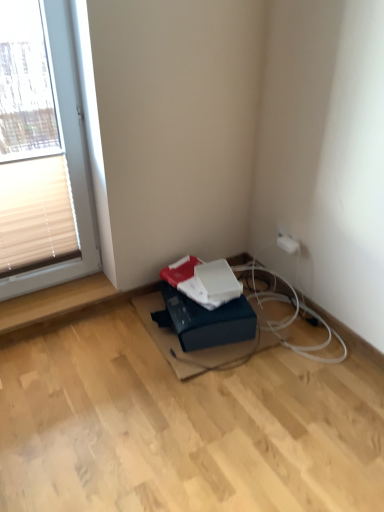
This screenshot has height=512, width=384. What do you see at coordinates (288, 243) in the screenshot?
I see `white plastic electric outlet at upper right` at bounding box center [288, 243].

Measure the distance between point [31,257] and camera.

The distance of point [31,257] from camera is 6.48 feet.

The width and height of the screenshot is (384, 512). Describe the element at coordinates (288, 318) in the screenshot. I see `black rubber cable at lower center` at that location.

You are a GUI agent. You are given a task and a screenshot of the screen. Output one action in this format:
    pyautogui.click(x=<x>, y=<y>)
    Task: Click on the white plastic electric outlet at upper right
    This screenshot has width=384, height=512.
    Given the screenshot: What is the action you would take?
    pyautogui.click(x=288, y=243)

Is beige fabric blind at left shorter than blue cardboard box at lower center?

Incorrect, the height of beige fabric blind at left does not fall short of that of blue cardboard box at lower center.

Consider the image. Is beige fabric blind at left bigger or smaller than blue cardboard box at lower center?

Clearly, beige fabric blind at left is smaller in size than blue cardboard box at lower center.

Can you see beige fabric blind at left touching blue cardboard box at lower center?

No, beige fabric blind at left is not beside blue cardboard box at lower center.

From a real-world perspective, which is physically above, beige fabric blind at left or blue cardboard box at lower center?

A: beige fabric blind at left is physically above.

Considering the relative sizes of black rubber cable at lower center and beige fabric blind at left in the image provided, is black rubber cable at lower center smaller than beige fabric blind at left?

Correct, black rubber cable at lower center occupies less space than beige fabric blind at left.

Consider the image. Which is in front, black rubber cable at lower center or beige fabric blind at left?

Positioned in front is beige fabric blind at left.

Considering the sizes of objects black rubber cable at lower center and beige fabric blind at left in the image provided, who is taller, black rubber cable at lower center or beige fabric blind at left?

beige fabric blind at left is taller.

Consider the image. Which is correct: white matte paperback book at center is inside white plastic electric outlet at upper right, or outside of it?

white matte paperback book at center is spatially situated outside white plastic electric outlet at upper right.

Is white matte paperback book at center positioned with its back to white plastic electric outlet at upper right?

No, white matte paperback book at center is not facing the opposite direction of white plastic electric outlet at upper right.

Where is `electric outlet that is behind the white matte paperback book at center`? The width and height of the screenshot is (384, 512). electric outlet that is behind the white matte paperback book at center is located at coordinates (288, 243).

Between white matte paperback book at center and white plastic electric outlet at upper right, which one has smaller size?

With smaller size is white plastic electric outlet at upper right.

Is white plastic window at upper left oriented towards white plastic electric outlet at upper right?

No.

Which object is further away from the camera taking this photo, white plastic window at upper left or white plastic electric outlet at upper right?

white plastic electric outlet at upper right is further away from the camera.

From a real-world perspective, is white plastic window at upper left over white plastic electric outlet at upper right?

Yes, from a real-world perspective, white plastic window at upper left is over white plastic electric outlet at upper right

Would you say white plastic electric outlet at upper right is part of white plastic window at upper left's contents?

Definitely not — white plastic electric outlet at upper right is not inside white plastic window at upper left.

Does white matte paperback book at center turn towards beige fabric blind at left?

No, white matte paperback book at center does not turn towards beige fabric blind at left.

Between white matte paperback book at center and beige fabric blind at left, which one appears on the left side from the viewer's perspective?

Positioned to the left is beige fabric blind at left.

Considering the relative sizes of white matte paperback book at center and beige fabric blind at left in the image provided, is white matte paperback book at center wider than beige fabric blind at left?

Correct, the width of white matte paperback book at center exceeds that of beige fabric blind at left.

From the picture: In terms of size, does white matte paperback book at center appear bigger or smaller than beige fabric blind at left?

white matte paperback book at center is smaller than beige fabric blind at left.

Is black rubber cable at lower center facing away from white plastic electric outlet at upper right?

No, black rubber cable at lower center is not facing the opposite direction of white plastic electric outlet at upper right.

From the image's perspective, relative to white plastic electric outlet at upper right, is black rubber cable at lower center above or below?

Clearly, from the image's perspective, black rubber cable at lower center is below white plastic electric outlet at upper right.

Consider the image. Considering the sizes of objects black rubber cable at lower center and white plastic electric outlet at upper right in the image provided, who is wider, black rubber cable at lower center or white plastic electric outlet at upper right?

black rubber cable at lower center.

Is white plastic electric outlet at upper right positioned far away from white matte paperback book at center?

They are positioned close to each other.

From a real-world perspective, is white plastic electric outlet at upper right above or below white matte paperback book at center?

white plastic electric outlet at upper right is situated higher than white matte paperback book at center in the real world.

Which is more to the right, white plastic electric outlet at upper right or white matte paperback book at center?

white plastic electric outlet at upper right.

Is white matte paperback book at center located within white plastic electric outlet at upper right?

Actually, white matte paperback book at center is outside white plastic electric outlet at upper right.

I want to click on cardboard box located on the right of beige fabric blind at left, so click(x=205, y=320).

This screenshot has height=512, width=384. Find the location of `blind on the left of the black rubber cable at lower center`. blind on the left of the black rubber cable at lower center is located at coordinates (35, 214).

In the scene shown: Estimate the real-world distances between objects in this image. Which object is further from beige fabric blind at left, white plastic electric outlet at upper right or white plastic window at upper left?

white plastic window at upper left.

Estimate the real-world distances between objects in this image. Which object is closer to white plastic electric outlet at upper right, beige fabric blind at left or black rubber cable at lower center?

black rubber cable at lower center is closer to white plastic electric outlet at upper right.

Based on their spatial positions, is black rubber cable at lower center or beige fabric blind at left further from blue cardboard box at lower center?

beige fabric blind at left is positioned further to the anchor blue cardboard box at lower center.

Based on their spatial positions, is blue cardboard box at lower center or black rubber cable at lower center further from white plastic electric outlet at upper right?

blue cardboard box at lower center is positioned further to the anchor white plastic electric outlet at upper right.

Based on the photo, considering their positions, is blue cardboard box at lower center positioned further to white matte paperback book at center than white plastic electric outlet at upper right?

Among the two, white plastic electric outlet at upper right is located further to white matte paperback book at center.

Estimate the real-world distances between objects in this image. Which object is further from white plastic window at upper left, white plastic electric outlet at upper right or white matte paperback book at center?

white plastic electric outlet at upper right lies further to white plastic window at upper left than the other object.

When comparing their distances from beige fabric blind at left, does white plastic window at upper left or black rubber cable at lower center seem closer?

black rubber cable at lower center lies closer to beige fabric blind at left than the other object.

Based on their spatial positions, is white matte paperback book at center or black rubber cable at lower center further from blue cardboard box at lower center?

Among the two, black rubber cable at lower center is located further to blue cardboard box at lower center.

Find the location of `cable between white plastic window at upper left and white plastic electric outlet at upper right from left to right`. cable between white plastic window at upper left and white plastic electric outlet at upper right from left to right is located at coordinates (288, 318).

Locate an element on the screen. The width and height of the screenshot is (384, 512). cardboard box located between beige fabric blind at left and white plastic electric outlet at upper right in the left-right direction is located at coordinates (205, 320).

What are the coordinates of `cardboard box situated between beige fabric blind at left and black rubber cable at lower center from left to right` in the screenshot? It's located at (205, 320).

This screenshot has height=512, width=384. I want to click on paperback book between beige fabric blind at left and white plastic electric outlet at upper right from left to right, so click(x=211, y=284).